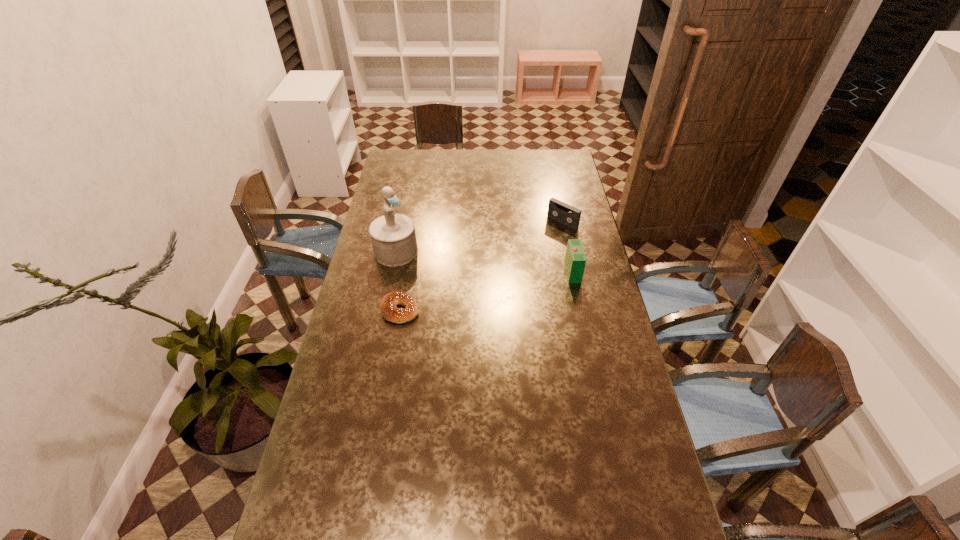
This screenshot has height=540, width=960. Identify the location of vacant space located on the front-facing side of the farthest object. (516, 261).

At what (x,y) coordinates should I click in order to perform the action: click on free region located on the front-facing side of the farthest object. Please return your answer as a coordinate pair (x, y). Looking at the image, I should click on (503, 272).

You are a GUI agent. You are given a task and a screenshot of the screen. Output one action in this format:
    pyautogui.click(x=<x>, y=<y>)
    Task: Click on the vacant space located 0.390m on the front-facing side of the farthest object
    
    Given the screenshot: What is the action you would take?
    pyautogui.click(x=496, y=278)

Find the location of a particular element. bagel that is at the left edge is located at coordinates (388, 306).

Find the location of a particular element. figurine that is at the left edge is located at coordinates (393, 237).

Find the location of a particular element. alarm clock present at the right edge is located at coordinates (575, 260).

The width and height of the screenshot is (960, 540). Identify the location of videotape that is at the right edge. (568, 215).

Where is `vacant position at the far edge of the desktop`? vacant position at the far edge of the desktop is located at coordinates (466, 172).

You are a GUI agent. You are given a task and a screenshot of the screen. Output one action in this format:
    pyautogui.click(x=<x>, y=<y>)
    Task: Click on the vacant space at the near edge of the desktop
    
    Given the screenshot: What is the action you would take?
    pyautogui.click(x=399, y=521)

This screenshot has width=960, height=540. I want to click on vacant space at the left edge of the desktop, so click(344, 374).